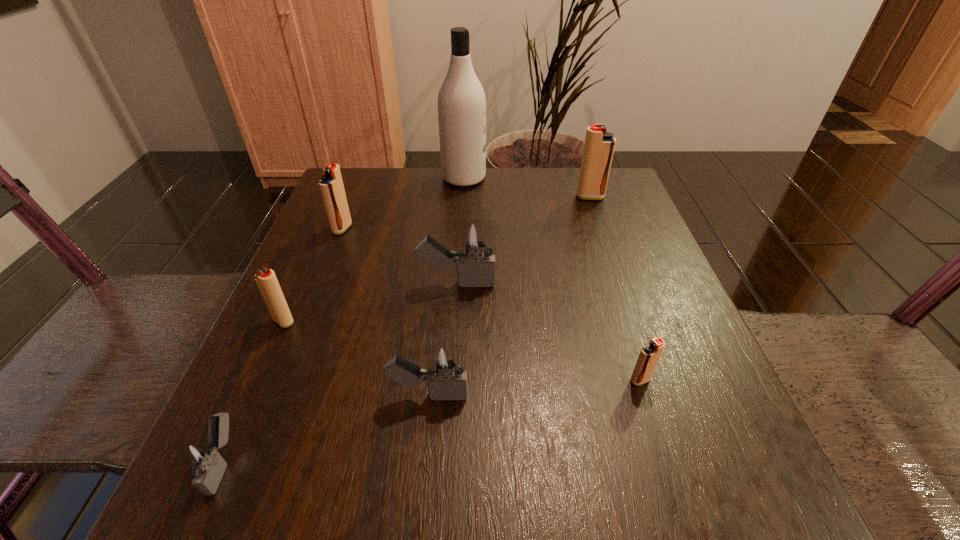
At what (x,y) coordinates should I click in order to perform the action: click on free space located on the left of the nearest red igniter. Please return your answer as a coordinate pair (x, y). The height and width of the screenshot is (540, 960). Looking at the image, I should click on (454, 380).

At what (x,y) coordinates should I click in order to perform the action: click on free space located on the back of the leftmost gray igniter. Please return your answer as a coordinate pair (x, y). Image resolution: width=960 pixels, height=540 pixels. Looking at the image, I should click on (259, 384).

I want to click on shampoo that is positioned at the far edge, so click(461, 100).

Locate an element on the screen. Image resolution: width=960 pixels, height=540 pixels. igniter present at the far edge is located at coordinates tap(599, 146).

Identify the location of object that is positioned at the near edge. (201, 461).

This screenshot has height=540, width=960. I want to click on object that is at the near left corner, so click(201, 461).

Locate an element on the screen. object situated at the far right corner is located at coordinates (599, 146).

Locate an element on the screen. The height and width of the screenshot is (540, 960). vacant space at the far edge of the desktop is located at coordinates (526, 187).

Locate an element on the screen. vacant region at the near edge is located at coordinates click(619, 470).

The image size is (960, 540). In the image, there is a desktop. What are the coordinates of `blank space at the left edge` in the screenshot? It's located at (366, 235).